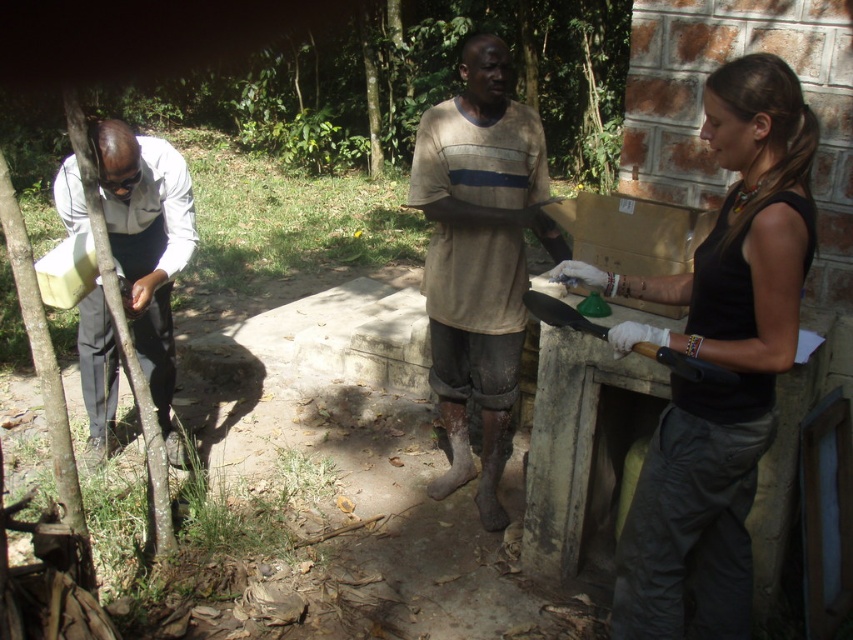
You are a construction worker observing the scene. There are two workers in the image. The first is wearing a black matte tank top at right, and the second is wearing a matte white shirt at left. Which worker is wearing a smaller top?

The black matte tank top at right is smaller than the matte white shirt at left, so the worker wearing the black matte tank top at right has the smaller top.

You are a safety inspector observing the workers in the scene. You notice two workers wearing shirts labeled as brown cotton shirt at center and matte white shirt at left. According to safety regulations, the width of the shirt must be at least 1 meter to allow proper movement. Can both workers comply with this requirement?

The brown cotton shirt at center has a width less than the matte white shirt at left. Since the minimum required width is 1 meter, only the matte white shirt at left meets the requirement. The brown cotton shirt at center is too narrow and does not comply with safety regulations.